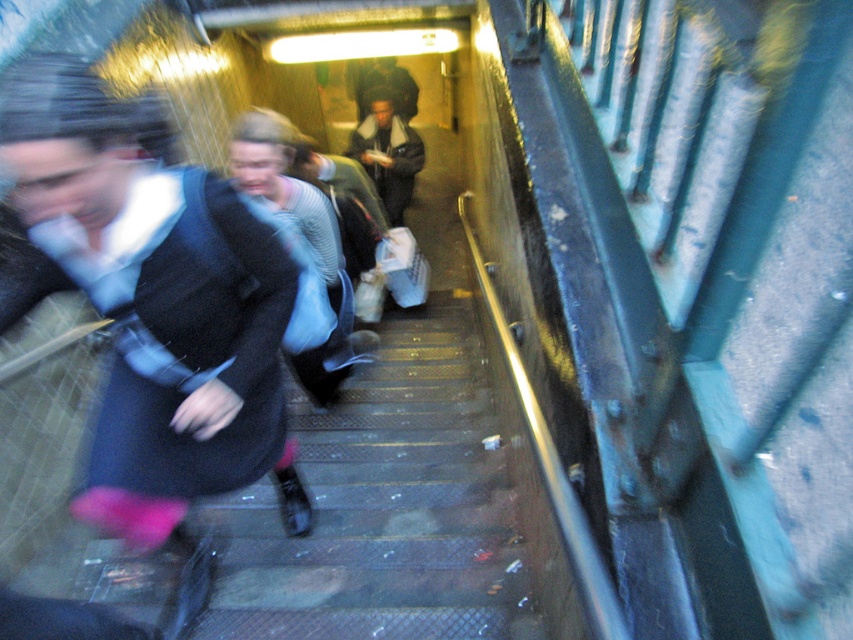
Question: Is dark gray jacket at center closer to camera compared to dark brown leather jacket at center?

Choices:
 (A) no
 (B) yes

Answer: (B)

Question: Which object appears farthest from the camera in this image?

Choices:
 (A) dark gray jacket at center
 (B) dark brown leather jacket at center
 (C) metallic gray stairs at center

Answer: (B)

Question: Which object is positioned closest to the dark brown leather jacket at center?

Choices:
 (A) dark gray jacket at center
 (B) matte black coat at left

Answer: (A)

Question: Is the position of metallic gray stairs at center less distant than that of dark gray jacket at center?

Choices:
 (A) yes
 (B) no

Answer: (A)

Question: In this image, where is matte black coat at left located relative to dark brown leather jacket at center?

Choices:
 (A) left
 (B) right

Answer: (B)

Question: Which point appears closest to the camera in this image?

Choices:
 (A) (361, 157)
 (B) (107, 577)
 (C) (86, 497)
 (D) (399, 67)

Answer: (C)